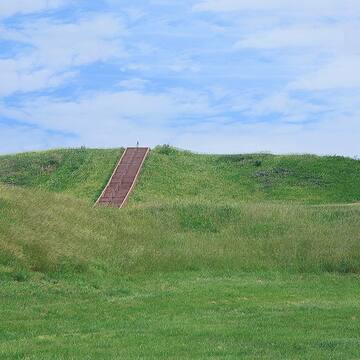
Locate an element on the screen. Image resolution: width=360 pixels, height=360 pixels. staircase is located at coordinates (127, 168).